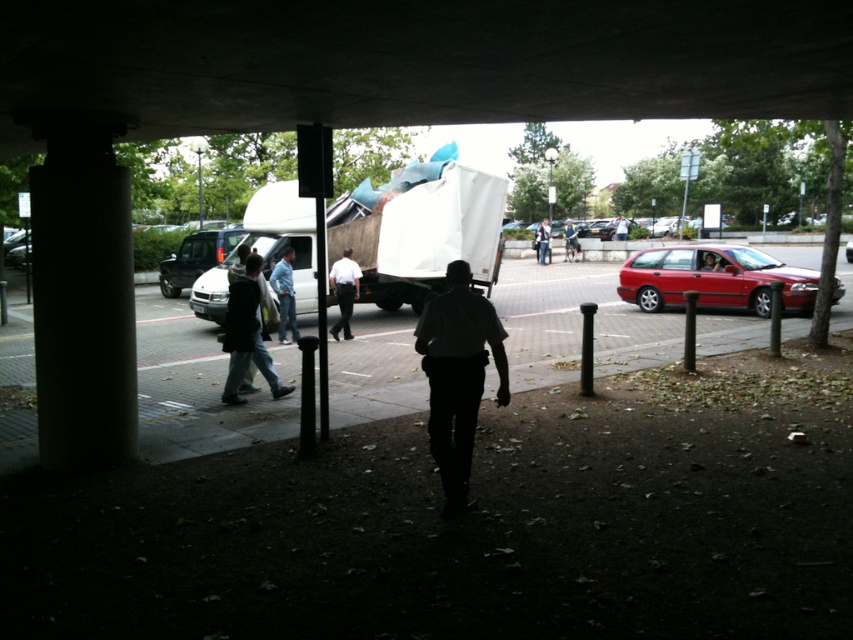
This screenshot has width=853, height=640. What do you see at coordinates (575, 323) in the screenshot?
I see `concrete pavement at center` at bounding box center [575, 323].

Can you confirm if concrete pavement at center is positioned below light blue shirt at center?

Yes.

Identify the location of concrete pavement at center. (575, 323).

Identify the location of concrete pavement at center. This screenshot has height=640, width=853. (575, 323).

Is point (564, 298) farther from viewer compared to point (341, 259)?

Yes, point (564, 298) is farther from viewer.

Who is more forward, [816,259] or [352,282]?

Positioned in front is point [352,282].

Where is `concrete pavement at center`? This screenshot has width=853, height=640. concrete pavement at center is located at coordinates (575, 323).

Is the position of white shirt at center less distant than that of blue jeans at center?

No, white shirt at center is behind blue jeans at center.

Measure the distance from white shirt at center to blue jeans at center.

white shirt at center and blue jeans at center are 1.01 meters apart.

Is point (339, 291) farther from viewer compared to point (293, 300)?

Yes, point (339, 291) is farther from viewer.

The image size is (853, 640). Identify the location of white shirt at center. (344, 291).